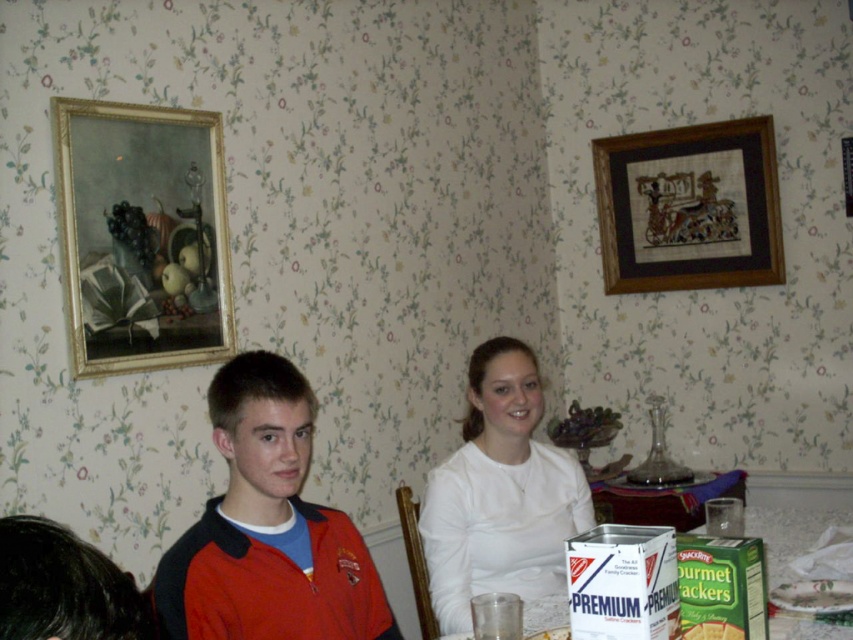
Based on the photo, you are organizing a small dinner party and need to place a decorative item on the table. The red jacket at center is currently taking up space. Since you want to keep the wooden framed artwork at upper right on display, which object should you consider moving to free up space without removing the artwork?

The red jacket at center has a lesser width compared to the wooden framed artwork at upper right, so you should consider moving the red jacket at center to free up space while keeping the artwork displayed.

You are a guest at a dinner party and notice the red jacket at center and the wooden framed artwork at upper right. Which object is positioned higher up on the wall?

The wooden framed artwork at upper right is positioned higher up on the wall than the red jacket at center, which is located below it.